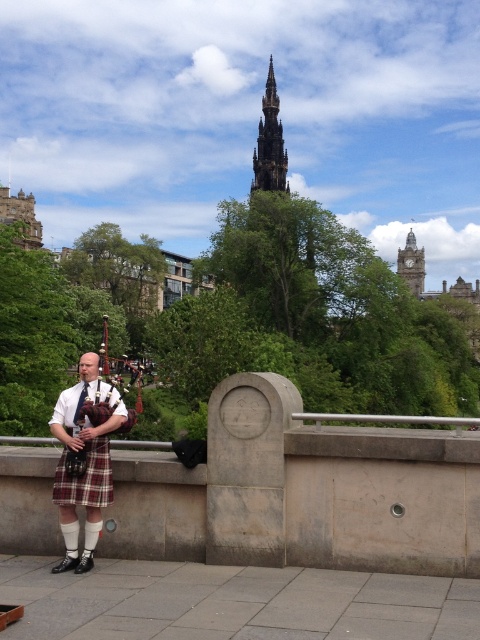
Can you confirm if dark brown stone spire at upper center is bigger than polished wood bagpipes at left?

Incorrect, dark brown stone spire at upper center is not larger than polished wood bagpipes at left.

Is dark brown stone spire at upper center smaller than polished wood bagpipes at left?

Indeed, dark brown stone spire at upper center has a smaller size compared to polished wood bagpipes at left.

Which is behind, point (267, 88) or point (69, 458)?

The point (267, 88) is more distant.

Where is `dark brown stone spire at upper center`? dark brown stone spire at upper center is located at coordinates (269, 144).

Is plaid fabric kilt at left to the left of dark brown stone spire at upper center from the viewer's perspective?

Correct, you'll find plaid fabric kilt at left to the left of dark brown stone spire at upper center.

Between plaid fabric kilt at left and dark brown stone spire at upper center, which one appears on the right side from the viewer's perspective?

dark brown stone spire at upper center

Between point (100, 486) and point (276, 150), which one is positioned behind?

Positioned behind is point (276, 150).

Image resolution: width=480 pixels, height=640 pixels. What are the coordinates of `plaid fabric kilt at left` in the screenshot? It's located at (85, 477).

Between plaid kilt at center and plaid fabric kilt at left, which one has more height?

With more height is plaid kilt at center.

Is point (83, 440) farther from viewer compared to point (78, 490)?

Yes, point (83, 440) is behind point (78, 490).

What do you see at coordinates (84, 460) in the screenshot?
I see `plaid kilt at center` at bounding box center [84, 460].

Where is `plaid kilt at center`? plaid kilt at center is located at coordinates (84, 460).